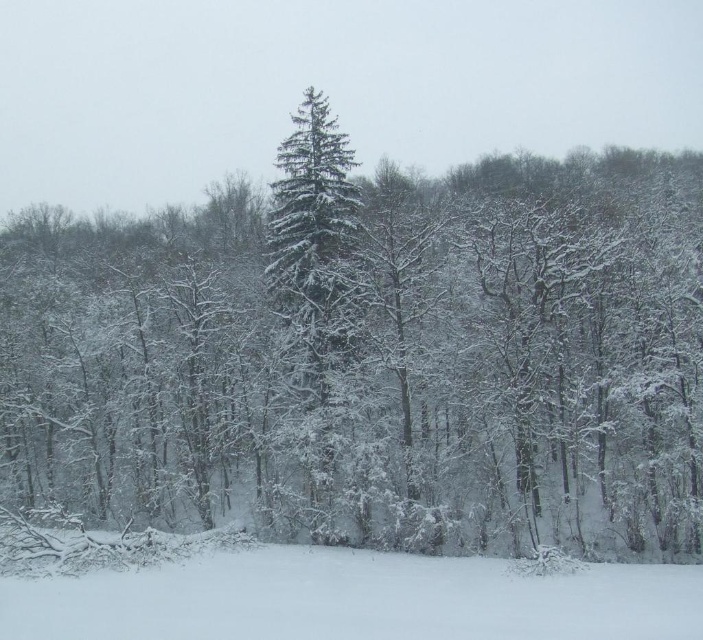
You are a snowboarder who just landed on the white fluffy snow at lower center after a jump. You want to reach the green matte evergreen tree at center to take a break. Given that your snowboard is 1.5 meters long, do you think you can make it to the tree without needing to stop?

The distance between the white fluffy snow at lower center and the green matte evergreen tree at center is 36.97 feet. Converting this to meters, 36.97 feet is approximately 11.27 meters. Since your snowboard is 1.5 meters long, you can comfortably travel the 11.27 meters to the tree without needing to stop.

You are standing at the edge of the forest in the winter scene. There is a point marked at coordinates (354, 600). What is located at this point?

The point at coordinates (354, 600) corresponds to white fluffy snow at lower center.